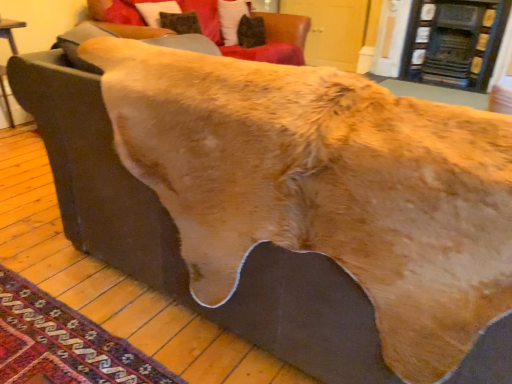
Question: Should I look upward or downward to see carpeted rug at lower left?

Choices:
 (A) down
 (B) up

Answer: (A)

Question: Are fur-like fabric at upper center and carpeted rug at lower left located far from each other?

Choices:
 (A) yes
 (B) no

Answer: (A)

Question: Considering the relative sizes of fur-like fabric at upper center and carpeted rug at lower left in the image provided, is fur-like fabric at upper center shorter than carpeted rug at lower left?

Choices:
 (A) yes
 (B) no

Answer: (B)

Question: From a real-world perspective, does fur-like fabric at upper center stand above carpeted rug at lower left?

Choices:
 (A) no
 (B) yes

Answer: (B)

Question: Considering the relative sizes of fur-like fabric at upper center and carpeted rug at lower left in the image provided, is fur-like fabric at upper center wider than carpeted rug at lower left?

Choices:
 (A) yes
 (B) no

Answer: (A)

Question: Is fur-like fabric at upper center at the left side of carpeted rug at lower left?

Choices:
 (A) no
 (B) yes

Answer: (A)

Question: From the image's perspective, would you say fur-like fabric at upper center is shown under carpeted rug at lower left?

Choices:
 (A) yes
 (B) no

Answer: (B)

Question: Considering the relative sizes of carpeted rug at lower left and fur-like fabric at upper center in the image provided, is carpeted rug at lower left thinner than fur-like fabric at upper center?

Choices:
 (A) yes
 (B) no

Answer: (A)

Question: Does carpeted rug at lower left touch fur-like fabric at upper center?

Choices:
 (A) no
 (B) yes

Answer: (A)

Question: Can you confirm if carpeted rug at lower left is wider than fur-like fabric at upper center?

Choices:
 (A) yes
 (B) no

Answer: (B)

Question: From the image's perspective, is carpeted rug at lower left located beneath fur-like fabric at upper center?

Choices:
 (A) yes
 (B) no

Answer: (A)

Question: From a real-world perspective, is carpeted rug at lower left below fur-like fabric at upper center?

Choices:
 (A) no
 (B) yes

Answer: (B)

Question: Is carpeted rug at lower left positioned far away from fur-like fabric at upper center?

Choices:
 (A) no
 (B) yes

Answer: (B)

Question: From a real-world perspective, is fur-like fabric at upper center over velvet dark brown pillow at upper center?

Choices:
 (A) yes
 (B) no

Answer: (B)